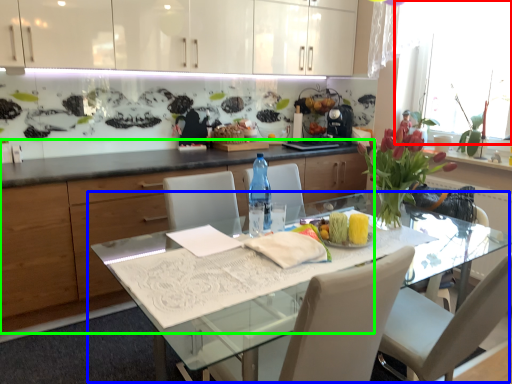
Question: Which object is positioned farthest from window screen (highlighted by a red box)? Select from kitchen & dining room table (highlighted by a blue box) and cabinetry (highlighted by a green box).

Choices:
 (A) kitchen & dining room table
 (B) cabinetry

Answer: (B)